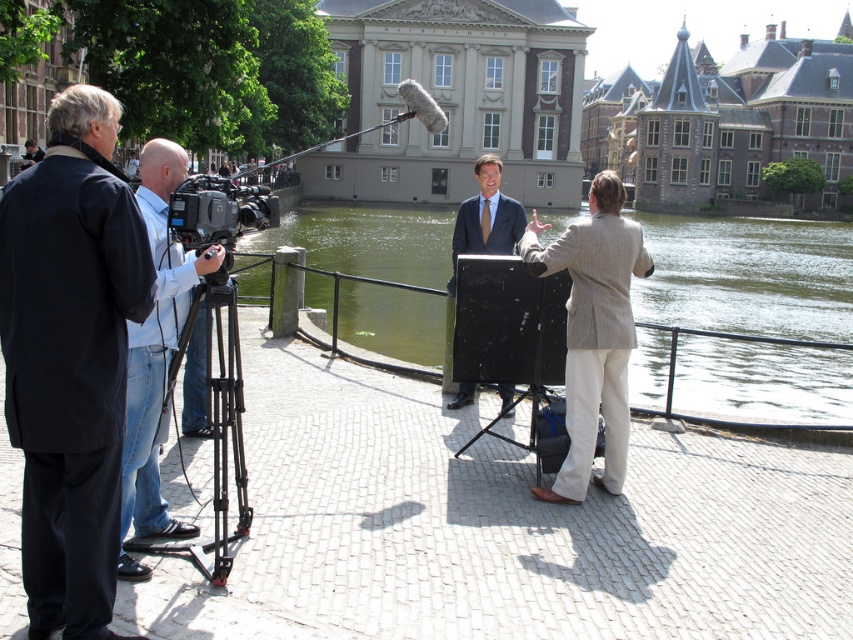
Can you confirm if stone gray building at upper center is wider than matte black video camera at left?

Yes.

Who is more forward, (775, 141) or (252, 196)?

Point (252, 196) is in front.

The width and height of the screenshot is (853, 640). Identify the location of stone gray building at upper center. (726, 124).

At what (x,y) coordinates should I click in order to perform the action: click on stone gray building at upper center. Please return your answer as a coordinate pair (x, y). Looking at the image, I should click on (726, 124).

Is light gray textured blazer at center wider than matte black video camera at left?

Indeed, light gray textured blazer at center has a greater width compared to matte black video camera at left.

Does light gray textured blazer at center have a lesser width compared to matte black video camera at left?

No.

Where is `light gray textured blazer at center`? The height and width of the screenshot is (640, 853). light gray textured blazer at center is located at coordinates (593, 332).

Where is `light gray textured blazer at center`? light gray textured blazer at center is located at coordinates (593, 332).

How distant is stone gray building at upper center from matte black suit at center?

stone gray building at upper center and matte black suit at center are 230.08 feet apart.

Is point (753, 184) farther from camera compared to point (492, 216)?

Yes, it is behind point (492, 216).

Identify the location of stone gray building at upper center. This screenshot has width=853, height=640. (726, 124).

I want to click on stone gray building at upper center, so click(726, 124).